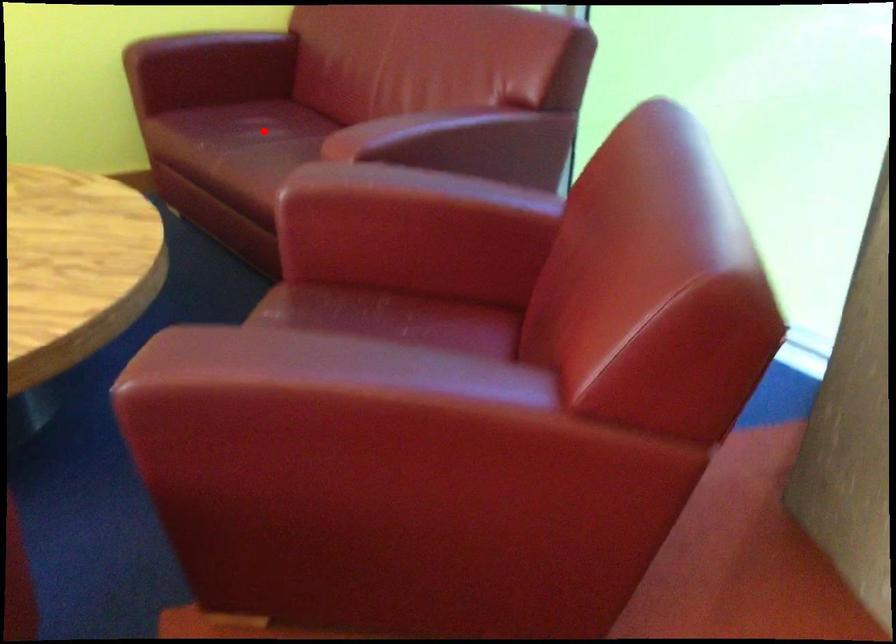
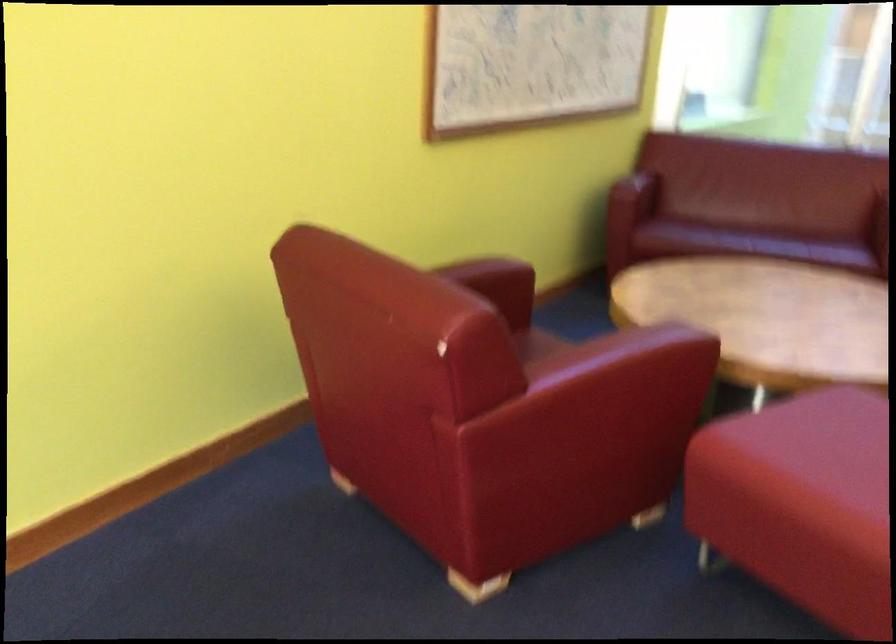
Question: I am providing you with two images of the same scene from different viewpoints. A red point is marked on the first image. Can you still see the location of the red point in image 2?

Choices:
 (A) Yes
 (B) No

Answer: (B)